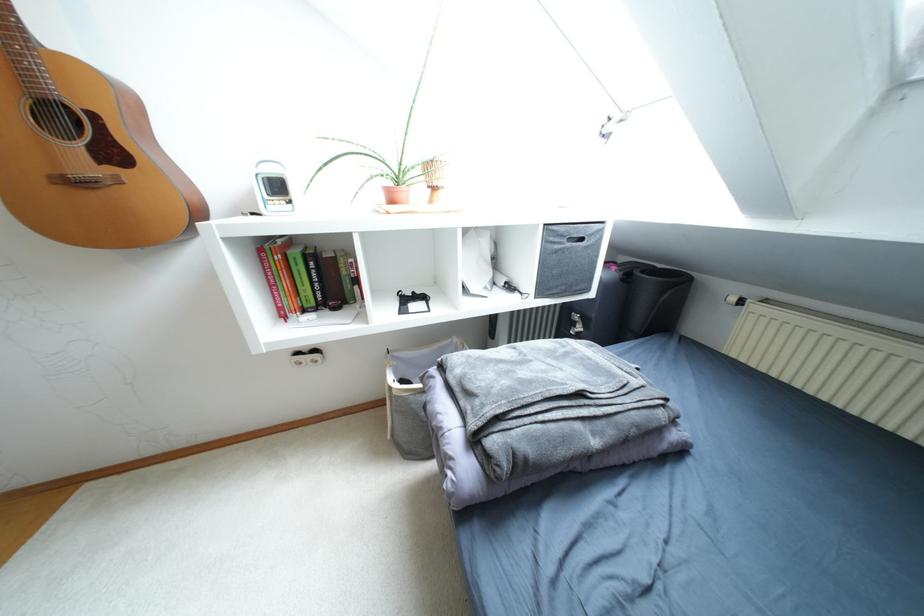
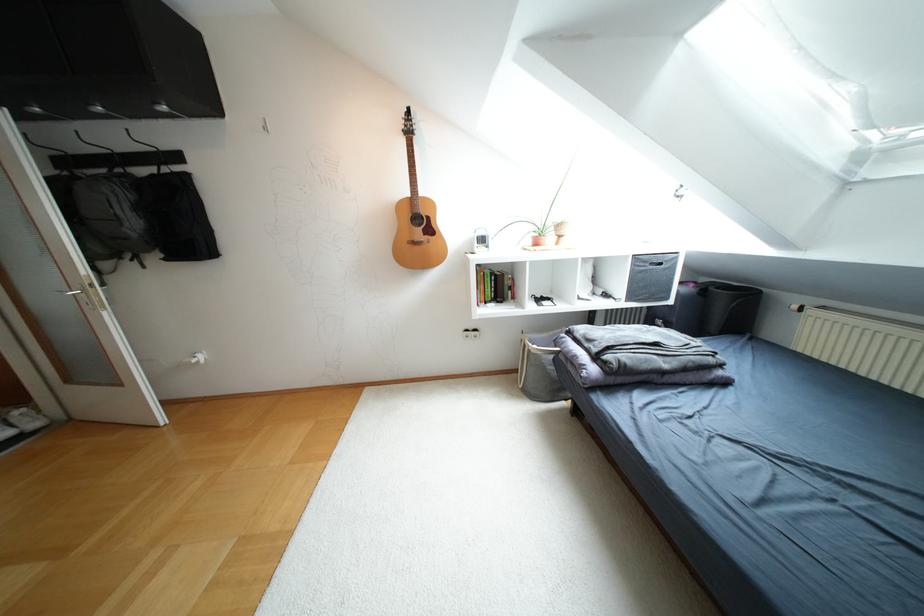
Locate, in the second image, the point that corresponds to pixel 418 169 in the first image.

(552, 227)